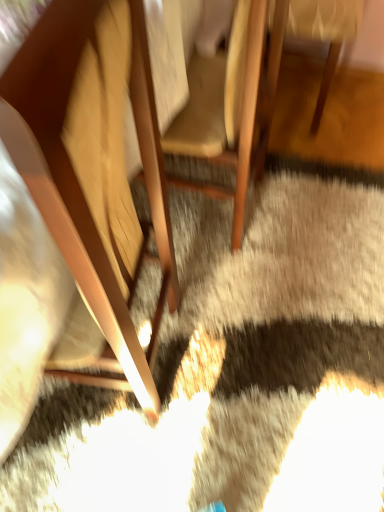
Question: Considering the relative sizes of wooden chair at left, which is the third chair in right-to-left order, and wooden chair at center, placed as the third chair when sorted from left to right, in the image provided, is wooden chair at left, which is the third chair in right-to-left order, bigger than wooden chair at center, placed as the third chair when sorted from left to right,?

Choices:
 (A) yes
 (B) no

Answer: (A)

Question: Can you confirm if wooden chair at left, which is the third chair in right-to-left order, is positioned to the left of wooden chair at center, the 1th chair positioned from the right?

Choices:
 (A) no
 (B) yes

Answer: (B)

Question: From a real-world perspective, is wooden chair at left, which is the third chair in right-to-left order, positioned under wooden chair at center, the 1th chair positioned from the right, based on gravity?

Choices:
 (A) no
 (B) yes

Answer: (A)

Question: Could you tell me if wooden chair at left, which is the third chair in right-to-left order, is turned towards wooden chair at center, the 1th chair positioned from the right?

Choices:
 (A) no
 (B) yes

Answer: (A)

Question: Considering the relative sizes of wooden chair at left, the 1th chair viewed from the left, and wooden chair at center, placed as the third chair when sorted from left to right, in the image provided, is wooden chair at left, the 1th chair viewed from the left, taller than wooden chair at center, placed as the third chair when sorted from left to right,?

Choices:
 (A) no
 (B) yes

Answer: (B)

Question: Considering the relative sizes of wooden chair at left, the 1th chair viewed from the left, and wooden chair at center, placed as the third chair when sorted from left to right, in the image provided, is wooden chair at left, the 1th chair viewed from the left, shorter than wooden chair at center, placed as the third chair when sorted from left to right,?

Choices:
 (A) no
 (B) yes

Answer: (A)

Question: Is the position of wooden chair at center, placed as the third chair when sorted from left to right, more distant than that of wooden chair at center, which appears as the second chair when viewed from the left?

Choices:
 (A) no
 (B) yes

Answer: (B)

Question: From the image's perspective, is wooden chair at center, the 1th chair positioned from the right, below wooden chair at center, the second chair in the right-to-left sequence?

Choices:
 (A) no
 (B) yes

Answer: (A)

Question: Does wooden chair at center, placed as the third chair when sorted from left to right, contain wooden chair at center, which appears as the second chair when viewed from the left?

Choices:
 (A) no
 (B) yes

Answer: (A)

Question: Considering the relative positions of wooden chair at center, placed as the third chair when sorted from left to right, and wooden chair at center, which appears as the second chair when viewed from the left, in the image provided, is wooden chair at center, placed as the third chair when sorted from left to right, to the left of wooden chair at center, which appears as the second chair when viewed from the left, from the viewer's perspective?

Choices:
 (A) yes
 (B) no

Answer: (B)

Question: Is wooden chair at center, placed as the third chair when sorted from left to right, located outside wooden chair at center, the second chair in the right-to-left sequence?

Choices:
 (A) yes
 (B) no

Answer: (A)

Question: Is wooden chair at center, the 1th chair positioned from the right, to the right of wooden chair at center, the second chair in the right-to-left sequence, from the viewer's perspective?

Choices:
 (A) no
 (B) yes

Answer: (B)

Question: From a real-world perspective, is wooden chair at center, the second chair in the right-to-left sequence, under wooden chair at center, placed as the third chair when sorted from left to right?

Choices:
 (A) no
 (B) yes

Answer: (A)